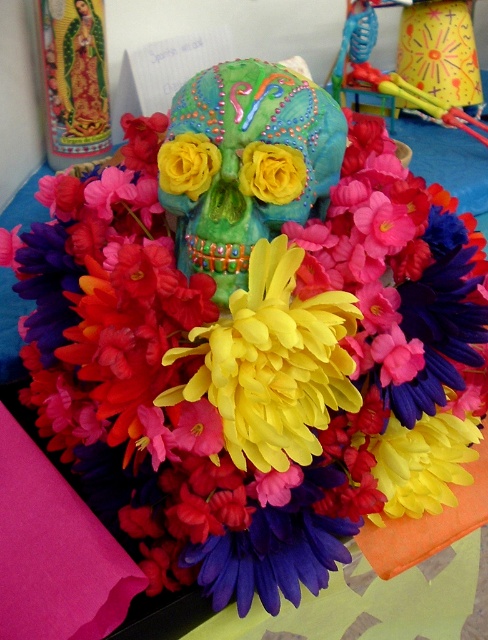
You are an artist trying to paint a flower arrangement that includes the matte painted skull at center and the yellow paper flower at center. Which object should you paint first to create the illusion of depth?

You should paint the yellow paper flower at center first because the matte painted skull at center is closer to the viewer, so it should be painted on top to create the illusion of depth.

You are an artist planning to create a balanced composition using the matte painted skull at center and the metallic blue toy at upper right. Considering their sizes, which object should you place closer to the center to maintain visual balance?

The matte painted skull at center is smaller than the metallic blue toy at upper right, so to maintain visual balance, the smaller matte painted skull at center should be placed closer to the center while the larger metallic blue toy at upper right can be positioned further out.

In the scene shown: You are setting up a display for a cultural festival and need to place the matte painted skull at center and the metallic blue toy at upper right. The space allocated for the display is narrow. Which object might not fit well in the narrow space due to its width?

The metallic blue toy at upper right is wider than the matte painted skull at center, so it might not fit well in the narrow space.